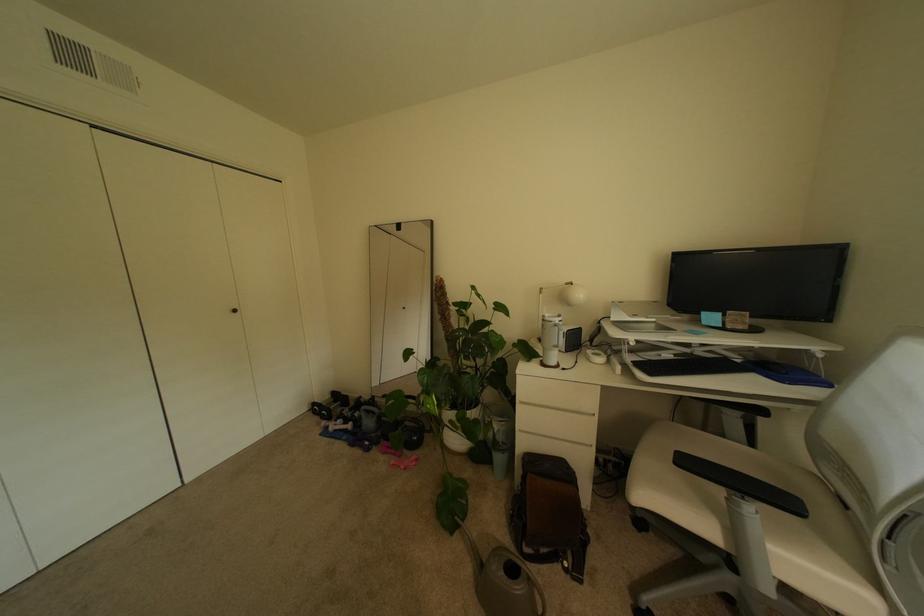
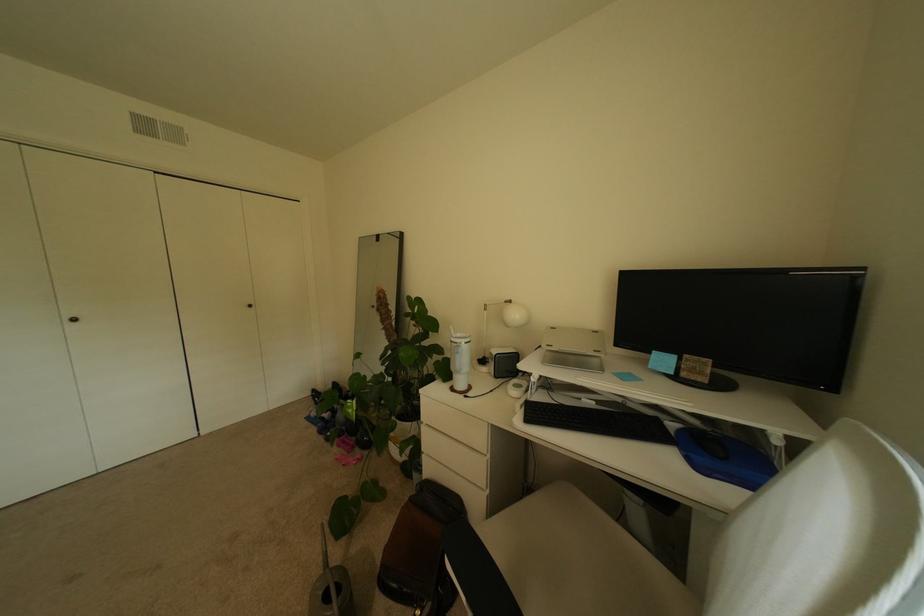
Question: The camera is either moving clockwise (left) or counter-clockwise (right) around the object. The first image is from the beginning of the video and the second image is from the end. Is the camera moving left or right when shooting the video?

Choices:
 (A) Left
 (B) Right

Answer: (B)